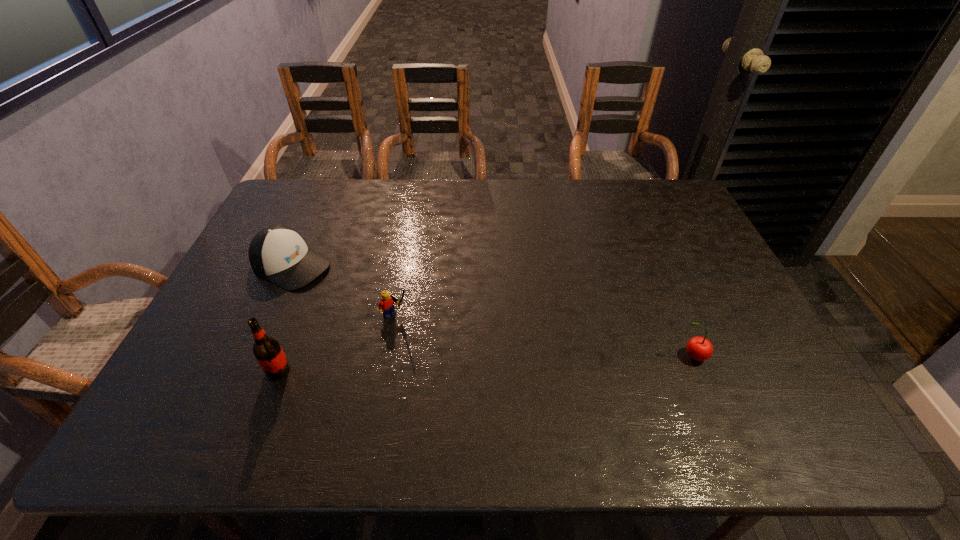
The width and height of the screenshot is (960, 540). What are the coordinates of `the tallest object` in the screenshot? It's located at (267, 350).

You are a GUI agent. You are given a task and a screenshot of the screen. Output one action in this format:
    pyautogui.click(x=<x>, y=<y>)
    Task: Click on the cherry
    
    Given the screenshot: What is the action you would take?
    pyautogui.click(x=698, y=348)

The width and height of the screenshot is (960, 540). I want to click on cap, so click(x=278, y=253).

Where is `the third object from left to right`? The width and height of the screenshot is (960, 540). the third object from left to right is located at coordinates (386, 305).

This screenshot has width=960, height=540. Identify the location of the second farthest object. (386, 305).

Find the location of a particular element. vacant space located 0.220m on the back of the root beer is located at coordinates point(307,295).

I want to click on vacant space located on the right of the cherry, so click(x=748, y=356).

Locate an element on the screen. vacant space located on the front panel of the cap is located at coordinates (351, 295).

Where is `vacant region located 0.200m on the front panel of the cap`? The width and height of the screenshot is (960, 540). vacant region located 0.200m on the front panel of the cap is located at coordinates (372, 306).

Where is `blank space located 0.370m on the front panel of the cap`? This screenshot has height=540, width=960. blank space located 0.370m on the front panel of the cap is located at coordinates (423, 332).